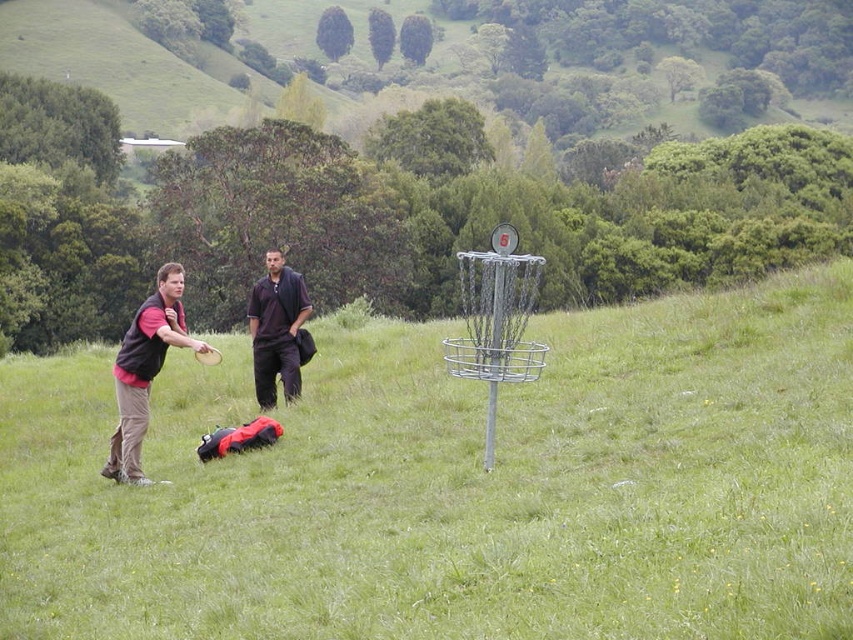
Question: Is reddish-pink fabric shirt at left closer to the viewer compared to dark purple shirt at center?

Choices:
 (A) no
 (B) yes

Answer: (B)

Question: Among these points, which one is farthest from the camera?

Choices:
 (A) (285, 374)
 (B) (163, 275)
 (C) (825, 266)
 (D) (119, 420)

Answer: (C)

Question: Considering the real-world distances, which object is closest to the matte black vest at left?

Choices:
 (A) dark purple shirt at center
 (B) green grassy field at center

Answer: (A)

Question: Does green grassy field at center appear over reddish-pink fabric shirt at left?

Choices:
 (A) no
 (B) yes

Answer: (B)

Question: Is matte black vest at left bigger than dark purple shirt at center?

Choices:
 (A) no
 (B) yes

Answer: (B)

Question: Which object appears farthest from the camera in this image?

Choices:
 (A) green grassy field at center
 (B) matte black vest at left
 (C) dark purple shirt at center

Answer: (C)